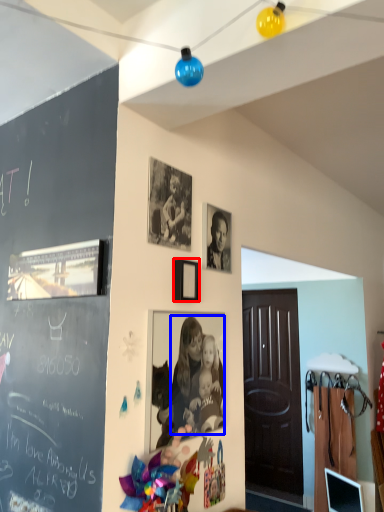
Question: Which point is further to the camera, picture frame (highlighted by a red box) or person (highlighted by a blue box)?

Choices:
 (A) picture frame
 (B) person

Answer: (A)